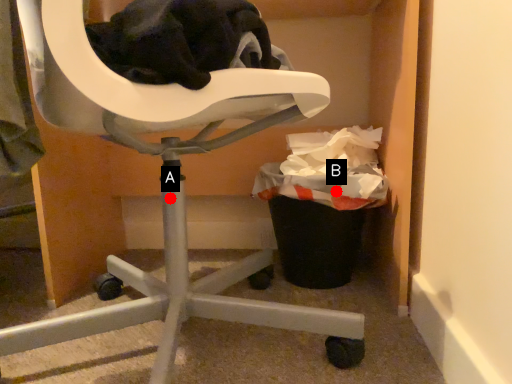
Question: Two points are circled on the image, labeled by A and B beside each circle. Which point is farther from the camera taking this photo?

Choices:
 (A) A is further
 (B) B is further

Answer: (B)